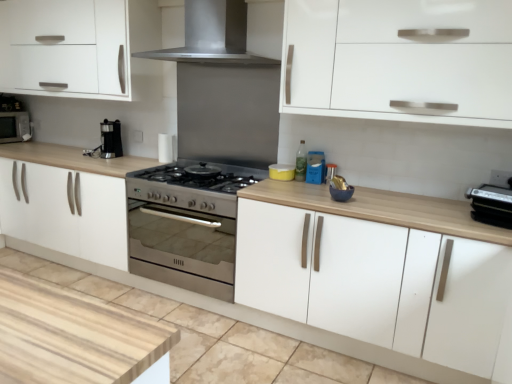
Question: Considering the positions of yellow matte container at center, which is the 1th appliance from back to front, and stainless steel range hood at upper center in the image, is yellow matte container at center, which is the 1th appliance from back to front, taller or shorter than stainless steel range hood at upper center?

Choices:
 (A) short
 (B) tall

Answer: (A)

Question: Is yellow matte container at center, which is the 1th appliance from back to front, inside the boundaries of stainless steel range hood at upper center, or outside?

Choices:
 (A) outside
 (B) inside

Answer: (A)

Question: Which is nearer to the white matte cabinet at lower center, arranged as the 2th cabinetry when viewed from the right?

Choices:
 (A) matte black microwave at left
 (B) white matte cabinet at center, which is the 2th cabinetry in left-to-right order
 (C) yellow matte container at center, marked as the 1th appliance in a left-to-right arrangement
 (D) stainless steel oven at center
 (E) black plastic toaster at right, which is the first appliance in right-to-left order

Answer: (E)

Question: Which object is positioned farthest from the white matte cabinet at lower center, arranged as the 2th cabinetry when viewed from the right?

Choices:
 (A) yellow matte container at center, the 3th appliance positioned from the front
 (B) white matte cabinet at center, which is the 2th cabinetry in left-to-right order
 (C) stainless steel range hood at upper center
 (D) matte black microwave at left
 (E) stainless steel oven at center

Answer: (D)